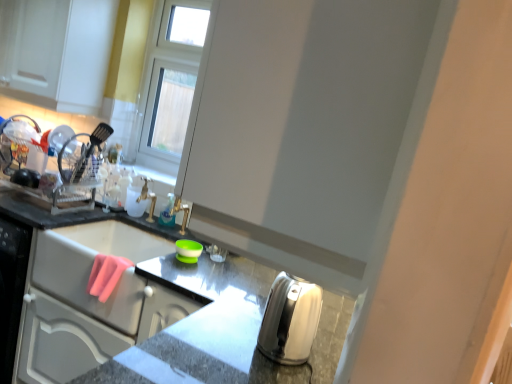
This screenshot has width=512, height=384. What are the coordinates of `free space to the left of satin silver kettle at lower right, the first appliance when ordered from front to back` in the screenshot? It's located at (207, 336).